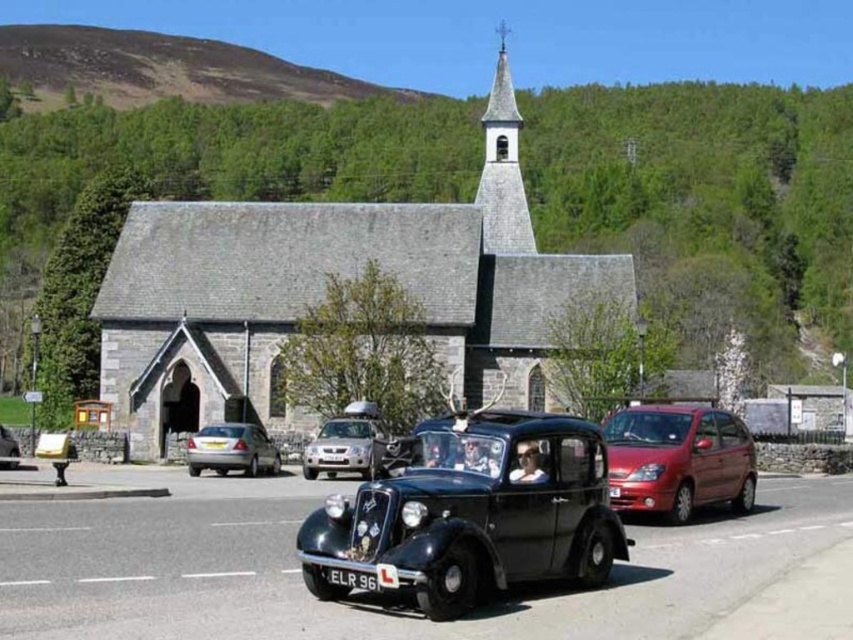
You are standing at the point with coordinates (x=471, y=515). What object is exactly at your current location?

The shiny black car at center is located at point (x=471, y=515).

Consider the image. You are a photographer trying to capture both the metallic red hatchback at right and the silver metallic car at center in a single frame. Since you want to emphasize the narrower vehicle, which car should you focus on and why?

The metallic red hatchback at right is thinner than the silver metallic car at center, so you should focus on the metallic red hatchback at right to emphasize its narrower width.